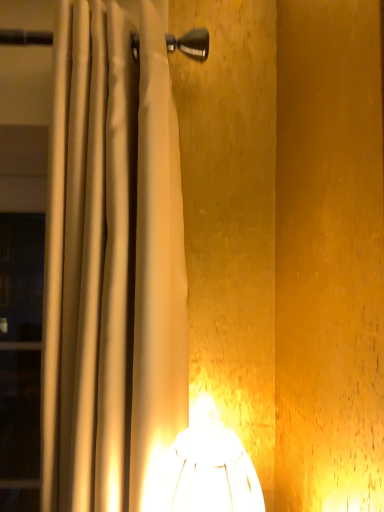
Describe the element at coordinates (111, 262) in the screenshot. This screenshot has width=384, height=512. I see `white fabric curtain at left` at that location.

Find the location of `white fabric curtain at left`. white fabric curtain at left is located at coordinates (111, 262).

Locate an element on the screen. This screenshot has width=384, height=512. white fabric curtain at left is located at coordinates (111, 262).